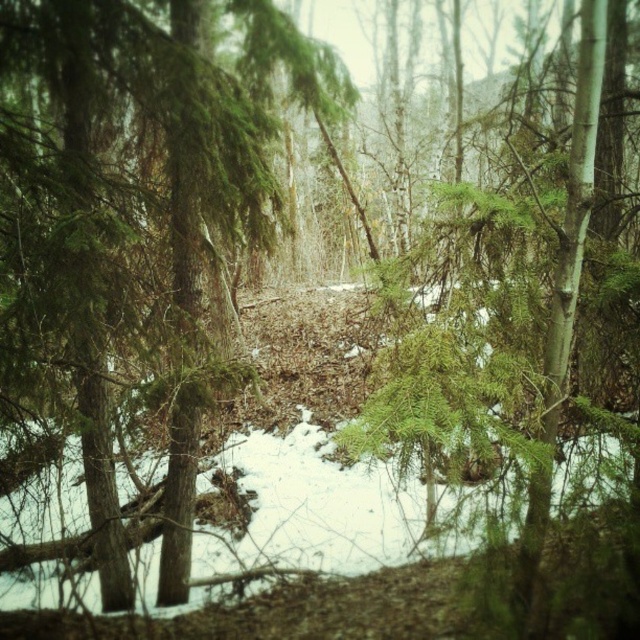
Based on the photo, you are standing at the point marked as point (128, 227) in the winter forest scene. Which type of tree are you currently standing on?

You are standing on a green needlelike tree at center because the point (128, 227) is located on it.